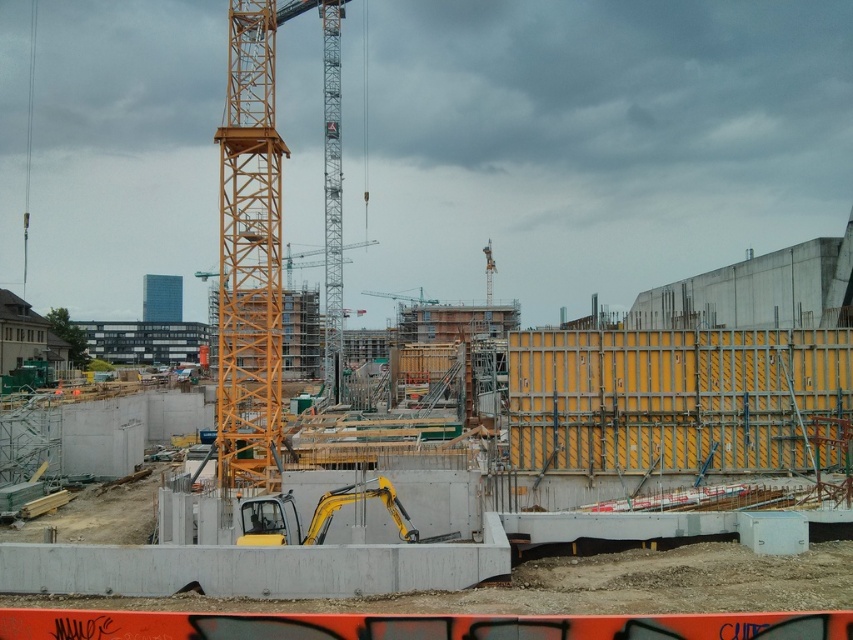
Based on the photo, is yellow metallic tower crane at center closer to the viewer compared to yellow metallic excavator at center?

No, it is not.

Who is more distant from viewer, (x=271, y=56) or (x=409, y=518)?

Point (x=271, y=56)

Locate an element on the screen. yellow metallic tower crane at center is located at coordinates (256, 237).